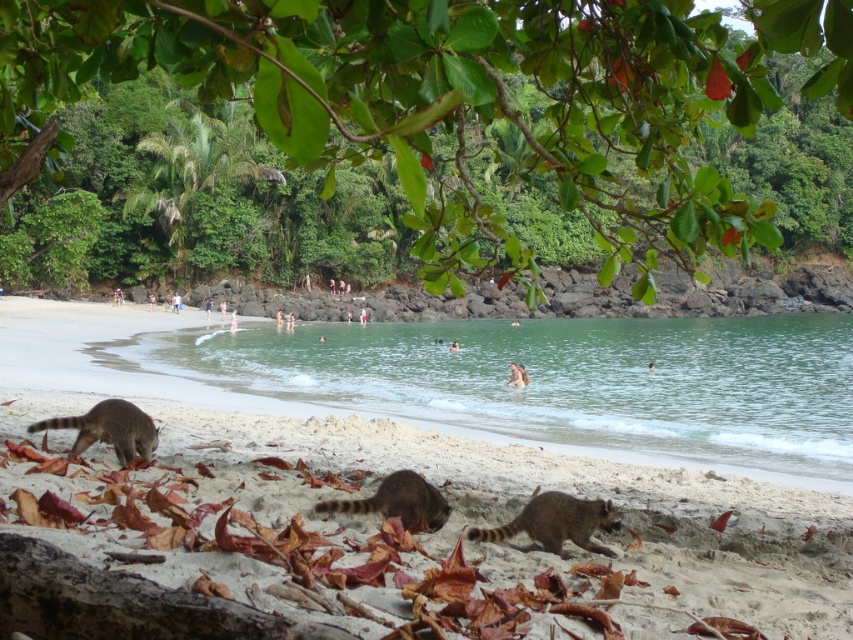
You are standing on the brown sandy beach at lower center and want to reach the brown fur raccoon at center. Which direction should you move to get closer to it?

The brown sandy beach at lower center is positioned under the brown fur raccoon at center, so you should move upward to reach it.

You are observing two raccoons on the beach. Which one has a smaller size? The raccoons are the brown fur raccoon at lower center and the brown fur raccoon at center.

The brown fur raccoon at lower center is smaller than the brown fur raccoon at center.

You are a photographer trying to capture a closeup shot of the brown fur raccoon at center while standing on the brown sandy beach at lower center. Given that the raccoon is smaller than the beach, can you still get a clear closeup without moving your position?

Yes, the brown sandy beach at lower center is larger in size than the brown fur raccoon at center, so you can position yourself to get a clear closeup of the raccoon while remaining on the beach.